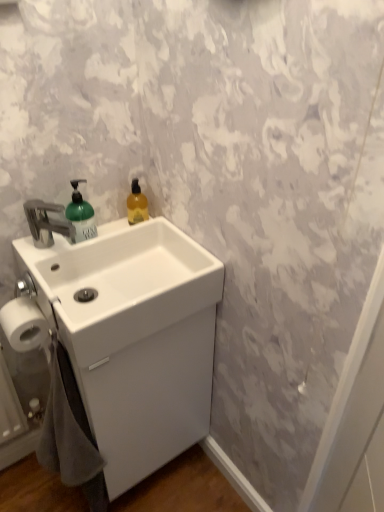
Question: Is the depth of white matte toilet paper at lower left greater than that of translucent amber liquid at upper right?

Choices:
 (A) yes
 (B) no

Answer: (B)

Question: Is white matte toilet paper at lower left closer to the viewer compared to translucent amber liquid at upper right?

Choices:
 (A) no
 (B) yes

Answer: (B)

Question: Can you confirm if white matte toilet paper at lower left is wider than translucent amber liquid at upper right?

Choices:
 (A) yes
 (B) no

Answer: (A)

Question: Is white matte toilet paper at lower left placed right next to translucent amber liquid at upper right?

Choices:
 (A) yes
 (B) no

Answer: (B)

Question: From a real-world perspective, is white matte toilet paper at lower left below translucent amber liquid at upper right?

Choices:
 (A) yes
 (B) no

Answer: (A)

Question: Considering the positions of gray cotton bath towel at lower left and translucent amber liquid at upper right in the image, is gray cotton bath towel at lower left bigger or smaller than translucent amber liquid at upper right?

Choices:
 (A) small
 (B) big

Answer: (B)

Question: Does point (74, 395) appear closer or farther from the camera than point (134, 212)?

Choices:
 (A) farther
 (B) closer

Answer: (B)

Question: Considering the positions of gray cotton bath towel at lower left and translucent amber liquid at upper right in the image, is gray cotton bath towel at lower left wider or thinner than translucent amber liquid at upper right?

Choices:
 (A) wide
 (B) thin

Answer: (A)

Question: From a real-world perspective, is gray cotton bath towel at lower left above or below translucent amber liquid at upper right?

Choices:
 (A) above
 (B) below

Answer: (B)

Question: Relative to green matte soap dispenser at left, is gray cotton bath towel at lower left in front or behind?

Choices:
 (A) behind
 (B) front

Answer: (B)

Question: Is gray cotton bath towel at lower left inside the boundaries of green matte soap dispenser at left, or outside?

Choices:
 (A) inside
 (B) outside

Answer: (B)

Question: Looking at the image, does gray cotton bath towel at lower left seem bigger or smaller compared to green matte soap dispenser at left?

Choices:
 (A) big
 (B) small

Answer: (A)

Question: Does point (79, 437) appear closer or farther from the camera than point (77, 225)?

Choices:
 (A) farther
 (B) closer

Answer: (B)

Question: From a real-world perspective, is white matte toilet paper at lower left positioned above or below gray cotton bath towel at lower left?

Choices:
 (A) below
 (B) above

Answer: (B)

Question: In the image, is white matte toilet paper at lower left on the left side or the right side of gray cotton bath towel at lower left?

Choices:
 (A) left
 (B) right

Answer: (A)